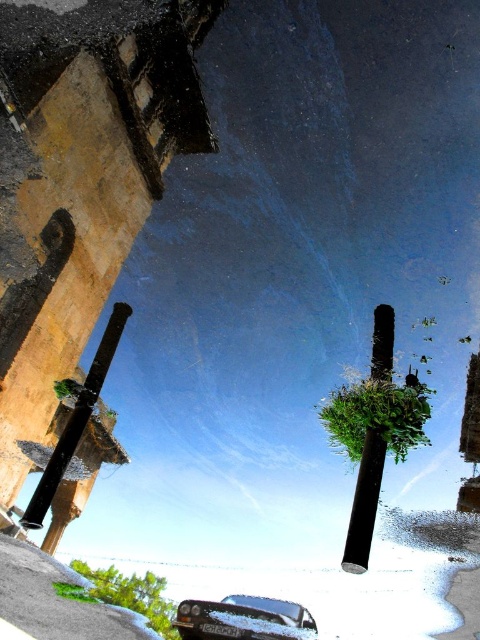
Between metallic silver car at lower center and black matte pole at center, which one appears on the right side from the viewer's perspective?

From the viewer's perspective, black matte pole at center appears more on the right side.

Can you confirm if metallic silver car at lower center is positioned to the right of black matte pole at center?

Incorrect, metallic silver car at lower center is not on the right side of black matte pole at center.

Between point (294, 612) and point (356, 502), which one is positioned in front?

Point (356, 502) is in front.

Identify the location of metallic silver car at lower center. Image resolution: width=480 pixels, height=640 pixels. (243, 618).

Where is `black matte pole at center`? This screenshot has height=640, width=480. black matte pole at center is located at coordinates (364, 502).

Identify the location of black matte pole at center. (364, 502).

Does metallic silver car at lower center appear on the right side of black glossy pole at left?

Indeed, metallic silver car at lower center is positioned on the right side of black glossy pole at left.

Is point (252, 605) positioned behind point (43, 486)?

No, (252, 605) is closer to viewer.

I want to click on metallic silver car at lower center, so click(243, 618).